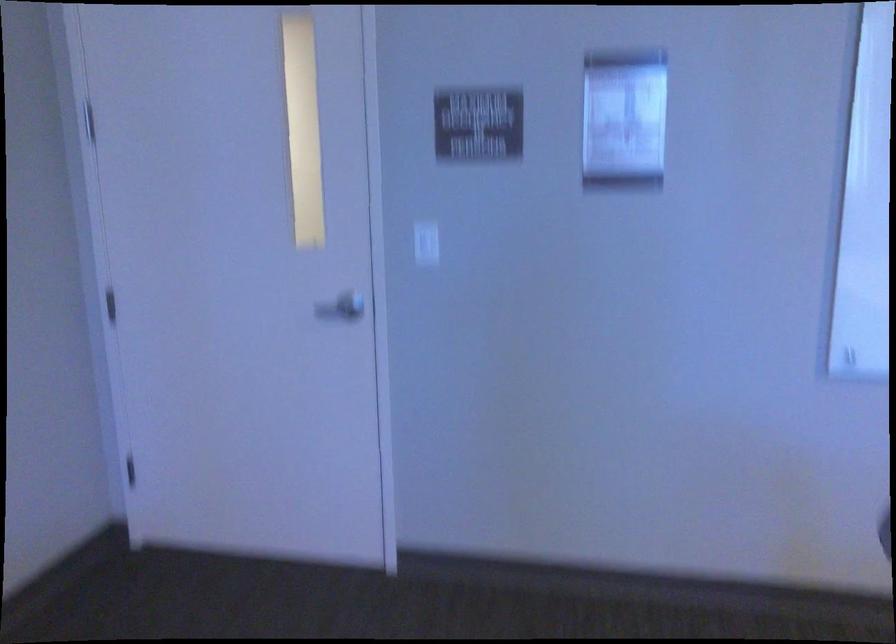
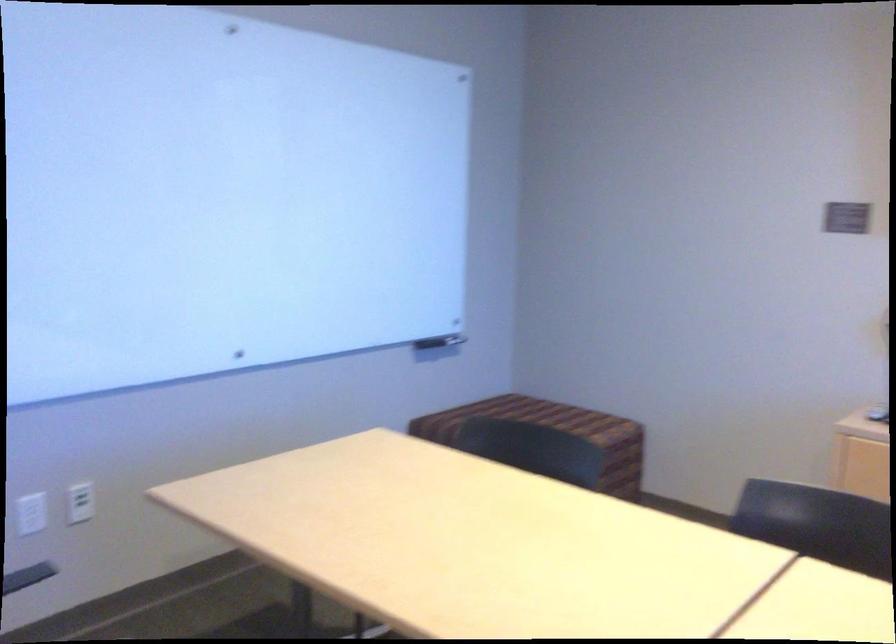
Question: The camera is either moving clockwise (left) or counter-clockwise (right) around the object. The first image is from the beginning of the video and the second image is from the end. Is the camera moving left or right when shooting the video?

Choices:
 (A) Left
 (B) Right

Answer: (A)